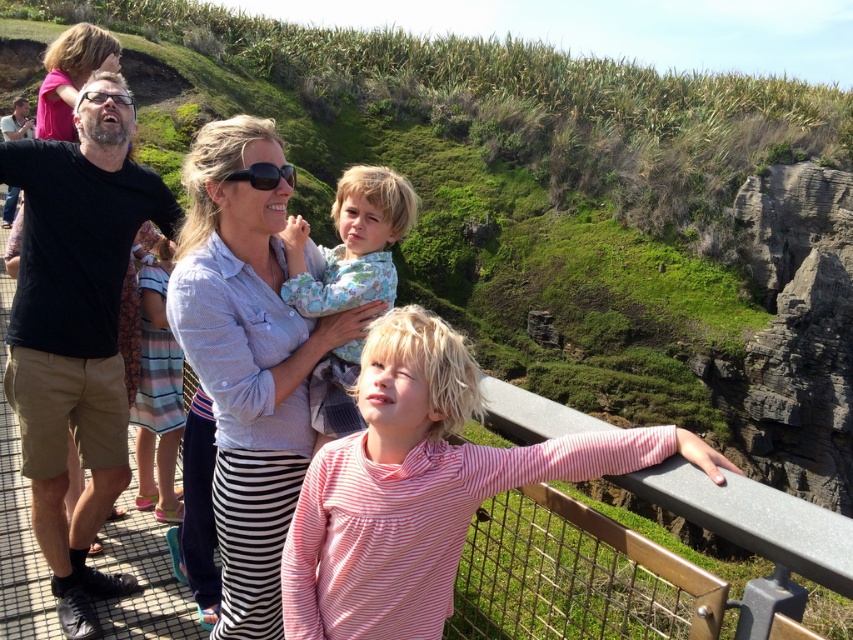
Question: Does light blue shirt at center appear on the right side of fluffy white clouds at upper center?

Choices:
 (A) no
 (B) yes

Answer: (A)

Question: Estimate the real-world distances between objects in this image. Which object is closer to the fluffy white clouds at upper center?

Choices:
 (A) clear plastic goggles at upper left
 (B) pink striped shirt at center
 (C) light blue shirt at center

Answer: (C)

Question: Is pink striped shirt at center to the left of light blue shirt at center from the viewer's perspective?

Choices:
 (A) no
 (B) yes

Answer: (A)

Question: Considering the real-world distances, which object is closest to the pink striped shirt at center?

Choices:
 (A) black matte sunglasses at center
 (B) light blue shirt at center

Answer: (A)

Question: Which is farther from the fluffy white clouds at upper center?

Choices:
 (A) black cotton shirt at left
 (B) matte black shirt at left
 (C) pink striped shirt at center
 (D) light blue shirt at center

Answer: (B)

Question: Observing the image, what is the correct spatial positioning of light blue shirt at center in reference to matte black shirt at left?

Choices:
 (A) below
 (B) above

Answer: (A)